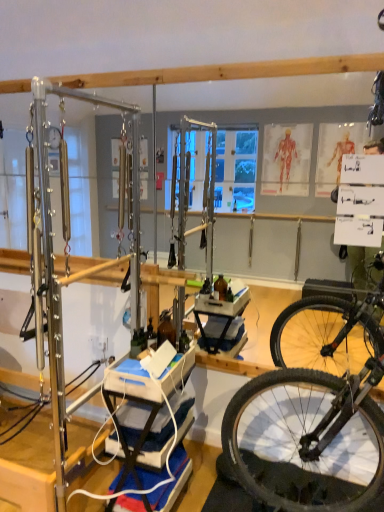
Question: From the image's perspective, relative to wooden table at center, is blue fabric yoga mat at lower center above or below?

Choices:
 (A) below
 (B) above

Answer: (A)

Question: Is blue fabric yoga mat at lower center wider or thinner than wooden table at center?

Choices:
 (A) thin
 (B) wide

Answer: (A)

Question: Does point (157, 506) appear closer or farther from the camera than point (180, 359)?

Choices:
 (A) farther
 (B) closer

Answer: (B)

Question: Considering the positions of wooden table at center and blue fabric yoga mat at lower center in the image, is wooden table at center bigger or smaller than blue fabric yoga mat at lower center?

Choices:
 (A) small
 (B) big

Answer: (B)

Question: From the image's perspective, relative to blue fabric yoga mat at lower center, is wooden table at center above or below?

Choices:
 (A) above
 (B) below

Answer: (A)

Question: Considering the positions of wooden table at center and blue fabric yoga mat at lower center in the image, is wooden table at center wider or thinner than blue fabric yoga mat at lower center?

Choices:
 (A) thin
 (B) wide

Answer: (B)

Question: From their relative heights in the image, would you say wooden table at center is taller or shorter than blue fabric yoga mat at lower center?

Choices:
 (A) short
 (B) tall

Answer: (B)